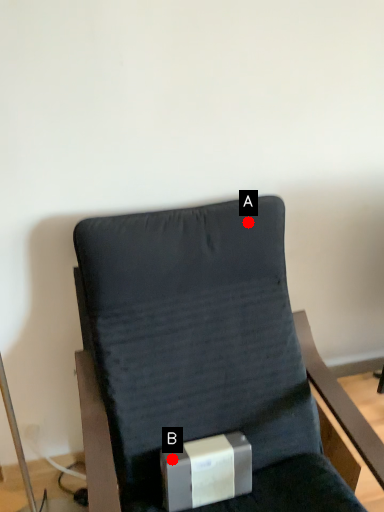
Question: Two points are circled on the image, labeled by A and B beside each circle. Which of the following is the closest to the observer?

Choices:
 (A) A is closer
 (B) B is closer

Answer: (B)